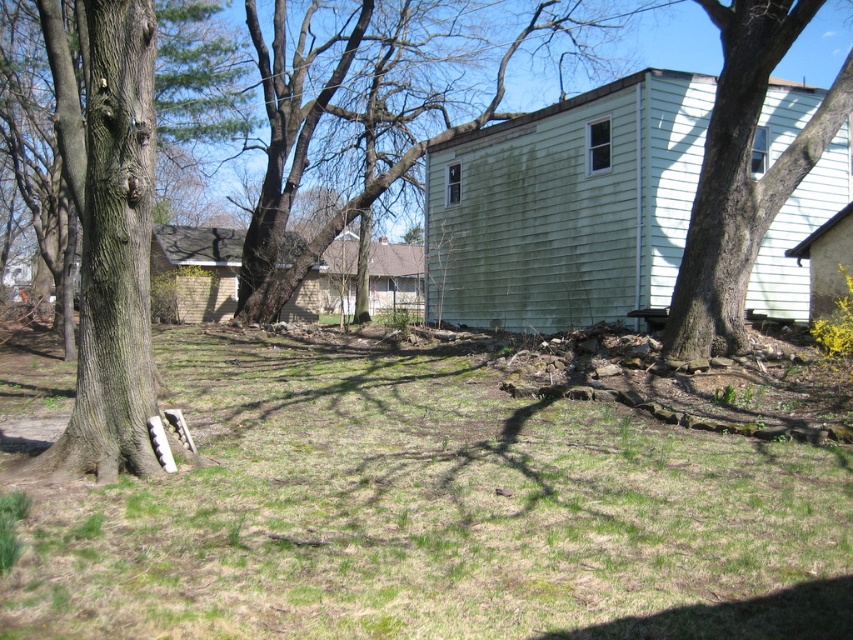
In the backyard scene, where exactly is the green painted wood siding at center right located in terms of coordinates?

The green painted wood siding at center right is located at coordinates point (567, 205).

You are planning to install a birdhouse in the backyard. The birdhouse requires a tree that is taller than 10 feet. Based on the scene, which tree between the brown rough bark tree at left and the smooth bark tree at right would be suitable for installing the birdhouse?

The smooth bark tree at right is taller than the brown rough bark tree at left. Since the birdhouse requires a tree taller than 10 feet, you should choose the smooth bark tree at right if it meets the height requirement, but the exact height isn

You are a painter planning to paint the brown rough bark tree at left and the green painted wood siding at center right. Which object requires more paint considering their widths?

The green painted wood siding at center right requires more paint because its width surpasses that of the brown rough bark tree at left.